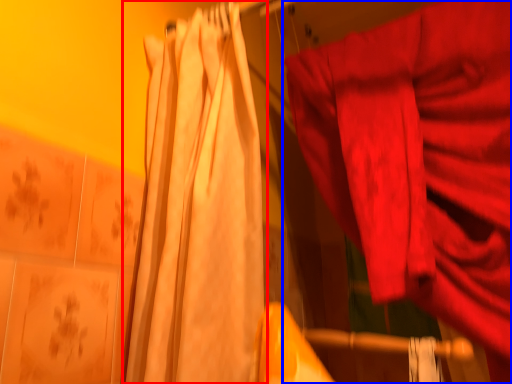
Question: Which point is further to the camera, curtain (highlighted by a red box) or curtain (highlighted by a blue box)?

Choices:
 (A) curtain
 (B) curtain

Answer: (B)